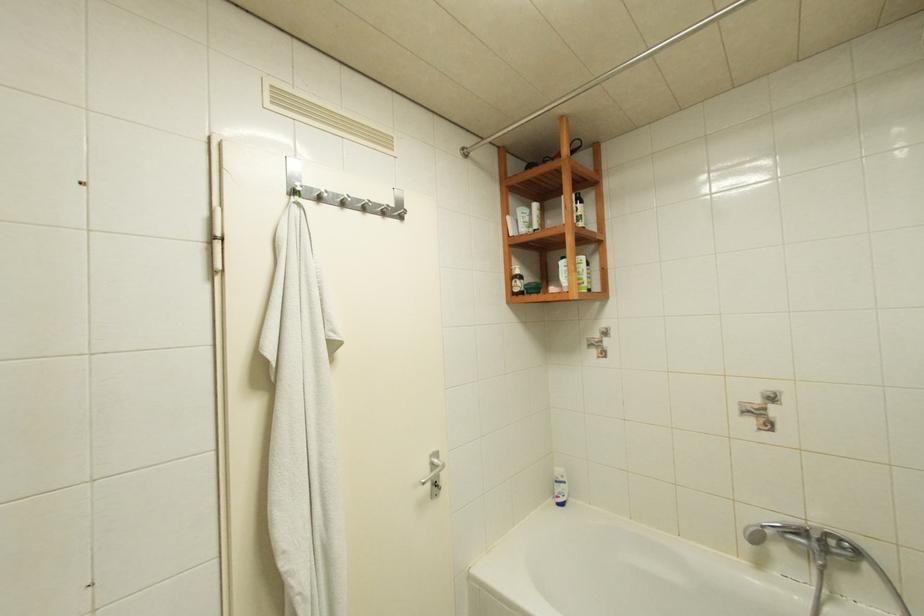
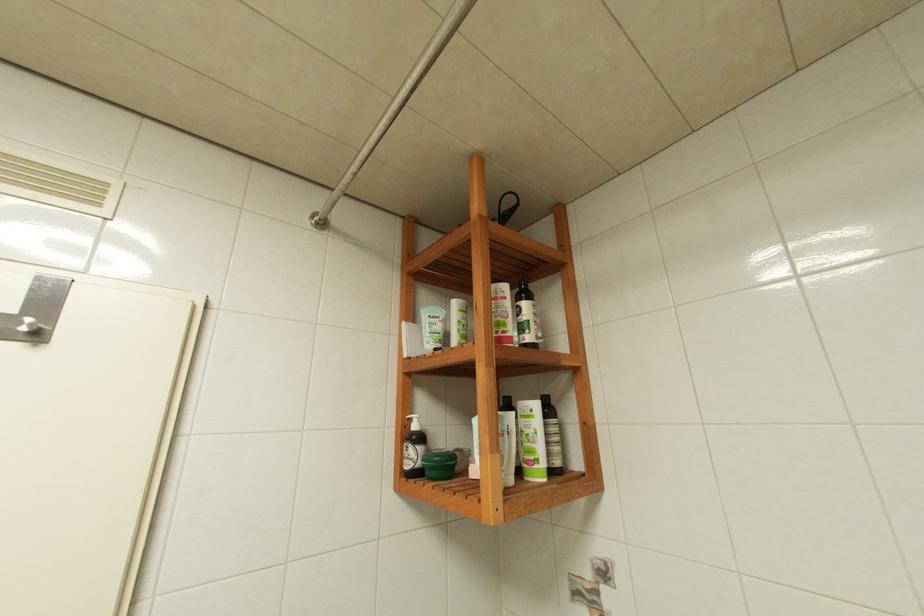
Question: The first image is from the beginning of the video and the second image is from the end. How did the camera likely rotate when shooting the video?

Choices:
 (A) Left
 (B) Right
 (C) Up
 (D) Down

Answer: (C)